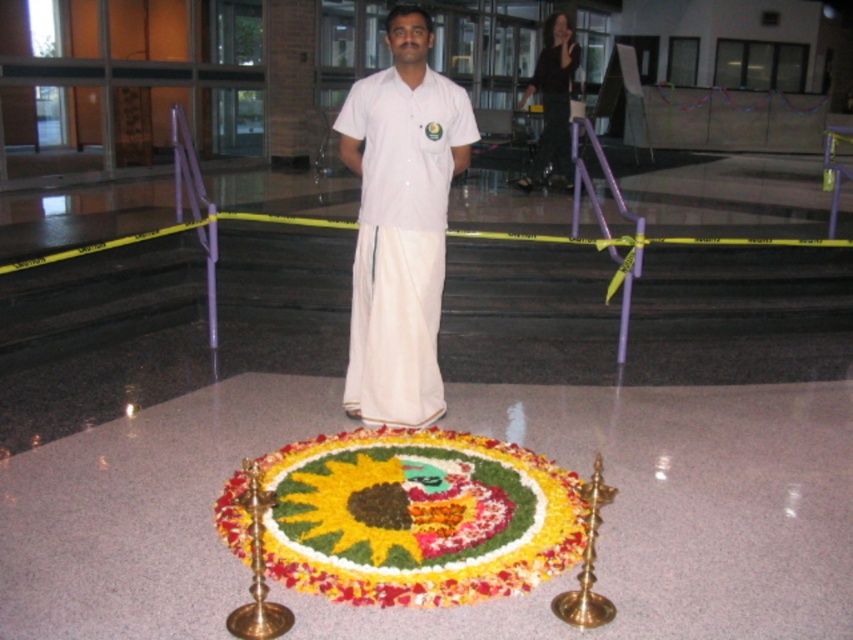
You are a photographer setting up a shoot in this room. You need to position a 1.5m tall tripod so that it doesn not block the view of the white cotton kurta at center and the black silk robe at upper center. Given their heights, which garment should the tripod be placed closer to?

The white cotton kurta at center is taller than the black silk robe at upper center. To avoid blocking the view, the tripod should be placed closer to the shorter garment, the black silk robe at upper center, since it requires less clearance.